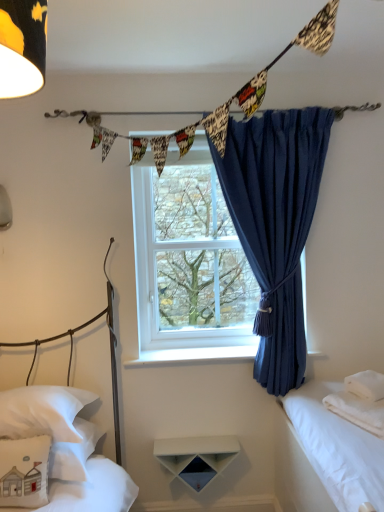
Question: Looking at the image, does clear glass window at center seem bigger or smaller compared to white soft towel at right?

Choices:
 (A) big
 (B) small

Answer: (A)

Question: Is point (163, 286) positioned closer to the camera than point (347, 395)?

Choices:
 (A) closer
 (B) farther

Answer: (B)

Question: Which object is the closest to the printed fabric bunting at upper center, positioned as the 1th clothesline in front-to-back order?

Choices:
 (A) white cotton bed at left, arranged as the second bed when viewed from the left
 (B) white cotton bed at right, acting as the first bed starting from the right
 (C) white soft towel at right
 (D) white smooth window sill at center
 (E) white soft pillow at lower left, acting as the first bed starting from the left

Answer: (D)

Question: Estimate the real-world distances between objects in this image. Which object is closer to the clear glass window at center?

Choices:
 (A) printed fabric bunting at upper center, the 2th clothesline from the back
 (B) white fabric pillow at lower left, which ranks as the 3th pillow in right-to-left order
 (C) white soft pillow at lower left, which ranks as the 2th pillow in left-to-right order
 (D) white soft pillow at right, which is the first pillow in right-to-left order
 (E) white cotton bed at right, acting as the 3th bed starting from the left

Answer: (E)